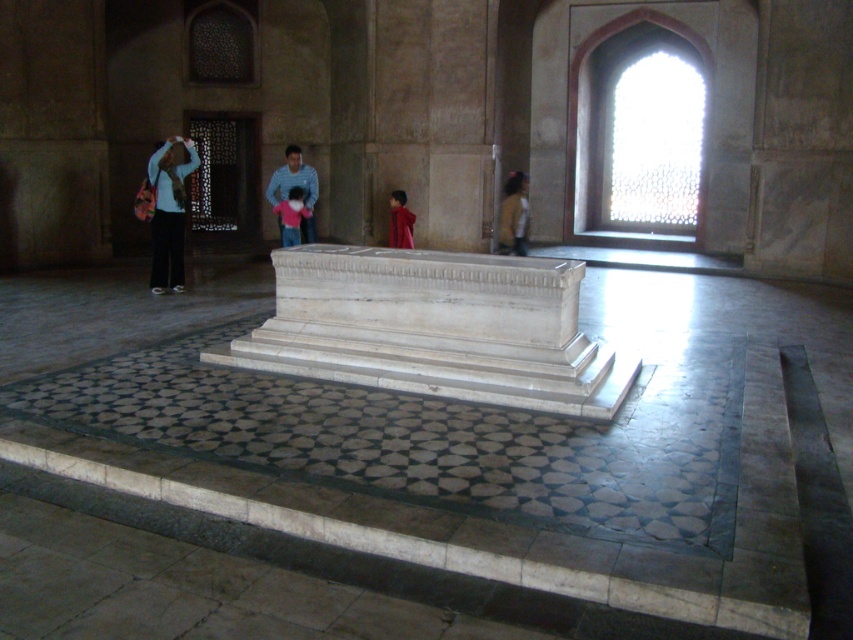
You are a visitor in this historical building and want to take a photo of the red velvet jacket at center without the light blue shirt at center blocking the view. Is this possible?

The light blue shirt at center is in front of the red velvet jacket at center, so you cannot take a photo of the red velvet jacket at center without the light blue shirt at center blocking the view.

You are a tailor observing two shirts in a room with a marble sarcophagus. The striped cotton shirt at center and the yellow matte shirt at right are laid out on a table. If you need to place both shirts side by side on a shelf that is exactly the width of the wider shirt, which shirt should you use to determine the shelf width?

The striped cotton shirt at center is wider than the yellow matte shirt at right, so you should use the striped cotton shirt at center to determine the shelf width.